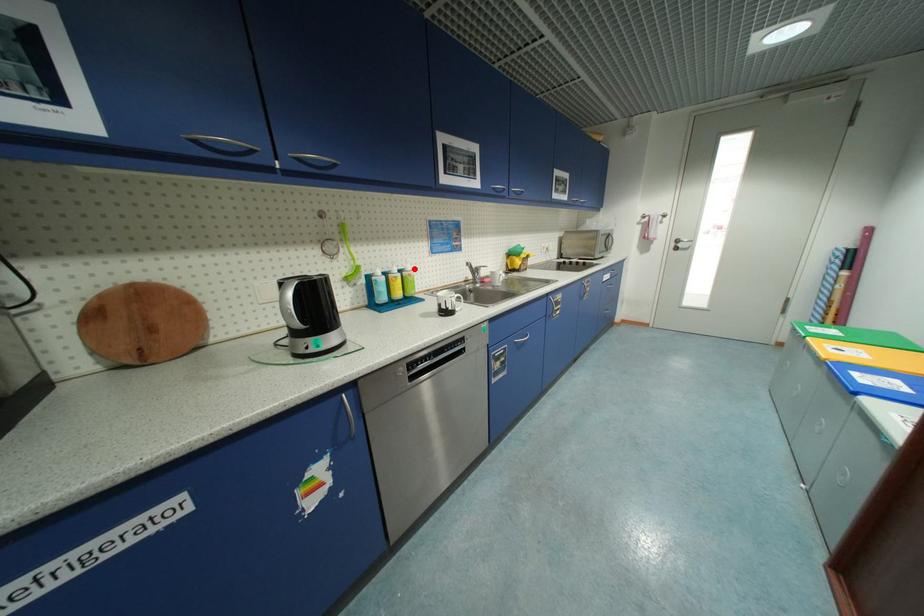
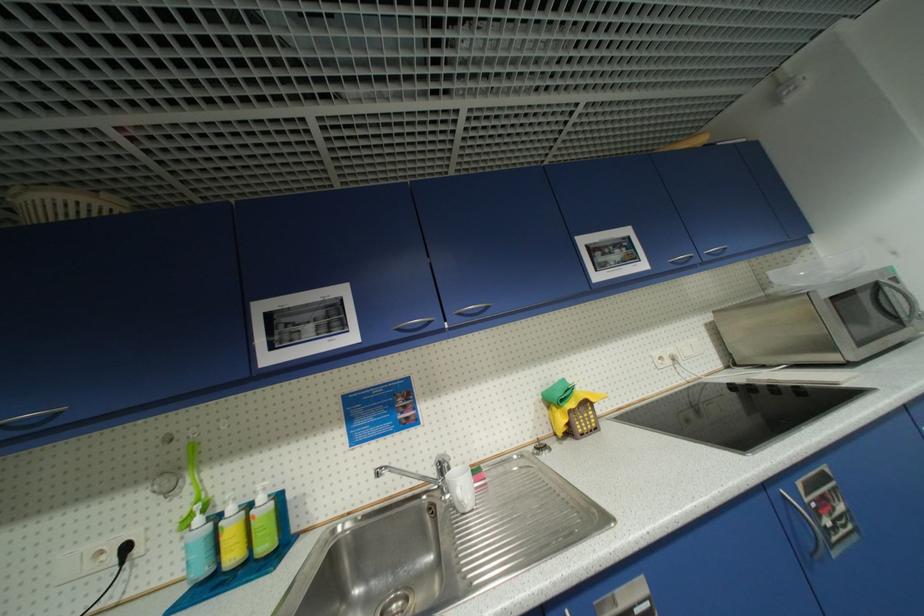
The point at the highlighted location is marked in the first image. Where is the corresponding point in the second image?

(266, 500)